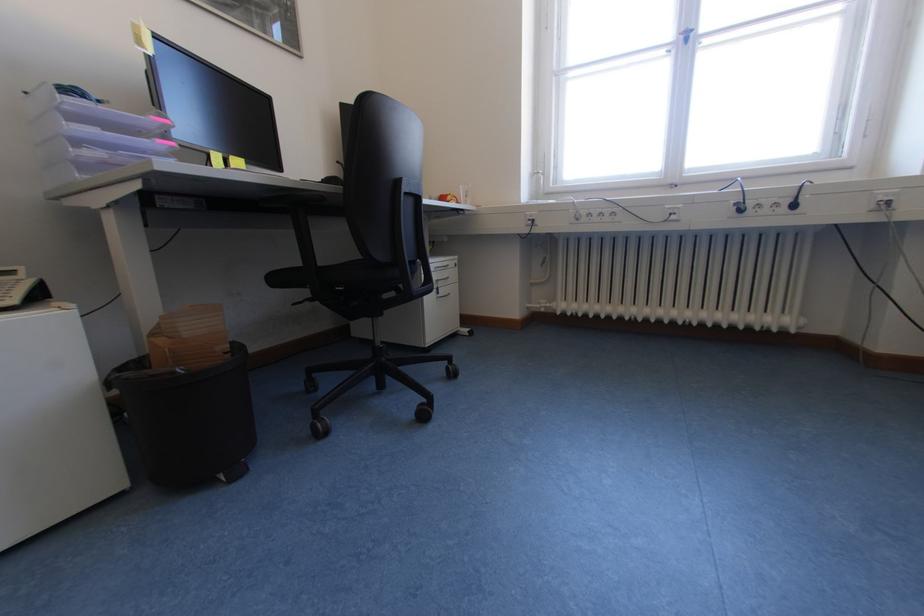
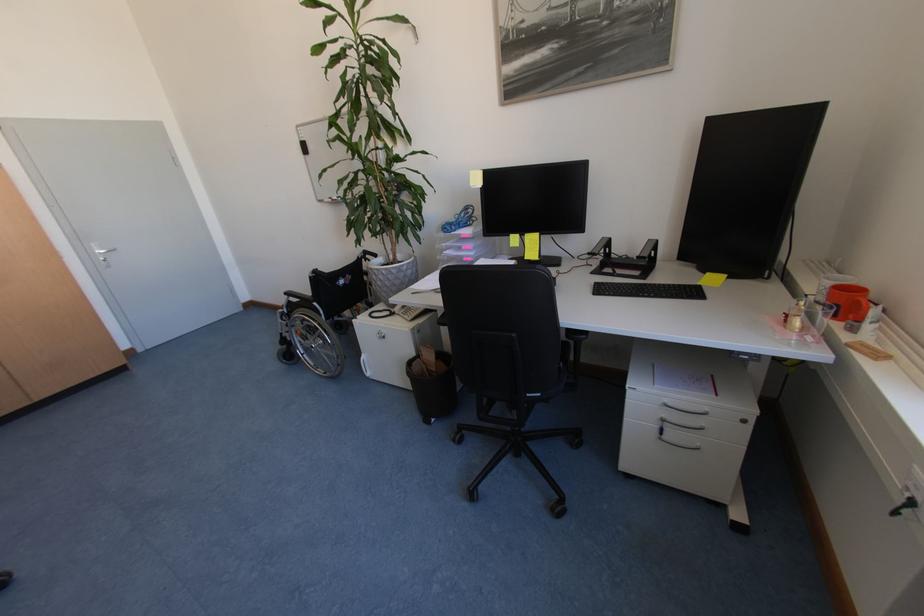
Where in the second image is the point corresponding to [464,265] from the first image?

(751, 422)